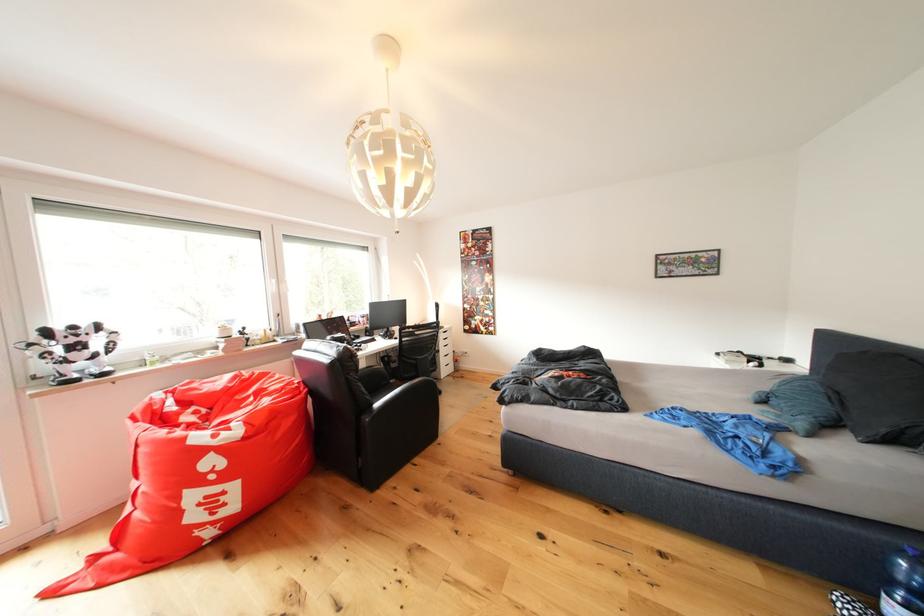
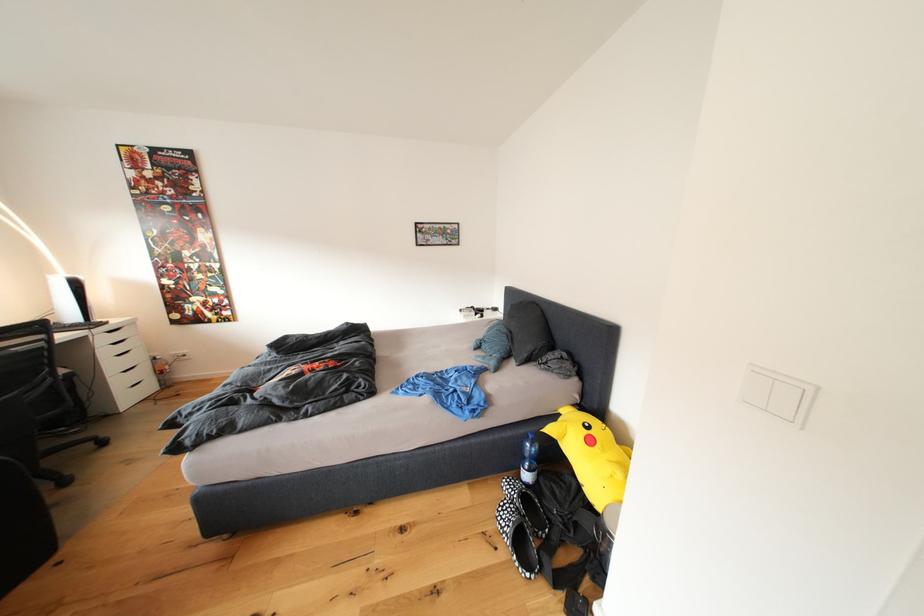
The point at (455, 331) is marked in the first image. Where is the corresponding point in the second image?

(125, 326)